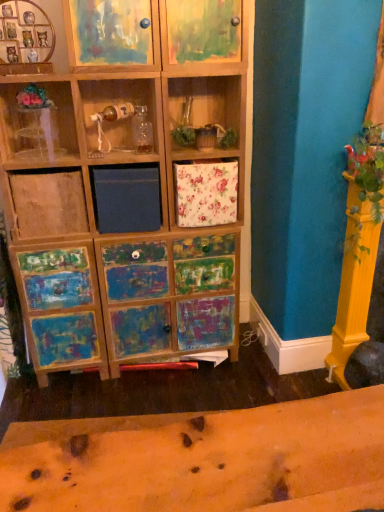
Question: Is painted wood cabinet at upper left, the 1th cabinet viewed from the left, taller or shorter than painted wood cabinet at upper center, the 2th cabinet positioned from the left?

Choices:
 (A) short
 (B) tall

Answer: (B)

Question: Considering the positions of painted wood cabinet at upper left, the 1th cabinet viewed from the left, and painted wood cabinet at upper center, the 2th cabinet positioned from the left, in the image, is painted wood cabinet at upper left, the 1th cabinet viewed from the left, bigger or smaller than painted wood cabinet at upper center, the 2th cabinet positioned from the left,?

Choices:
 (A) big
 (B) small

Answer: (B)

Question: Estimate the real-world distances between objects in this image. Which object is closer to the transparent plastic vase at upper left?

Choices:
 (A) painted wood cabinet at upper left, marked as the 2th cabinet in a right-to-left arrangement
 (B) painted wood cabinet at upper center, the 2th cabinet positioned from the left

Answer: (A)

Question: Which of these objects is positioned farthest from the painted wood cabinet at upper left, the 1th cabinet viewed from the left?

Choices:
 (A) transparent plastic vase at upper left
 (B) painted wood cabinet at upper center, the 2th cabinet positioned from the left

Answer: (A)